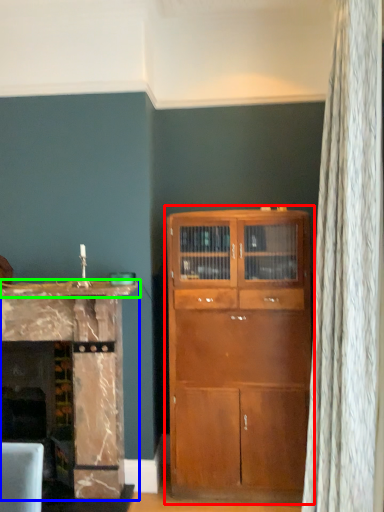
Question: Considering the real-world distances, which object is farthest from cupboard (highlighted by a red box)? cabinetry (highlighted by a blue box) or counter top (highlighted by a green box)?

Choices:
 (A) cabinetry
 (B) counter top

Answer: (B)